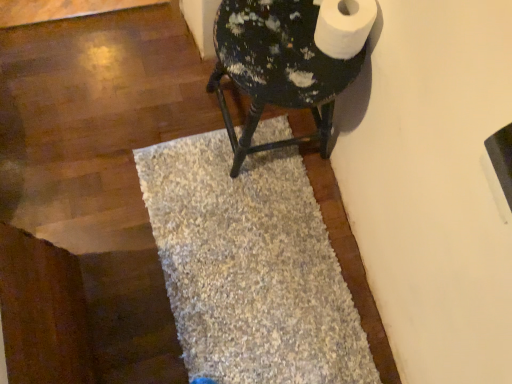
What are the coordinates of `vacant space that is in between painted wood stool at upper right and beige shaggy bath mat at center` in the screenshot? It's located at (319, 196).